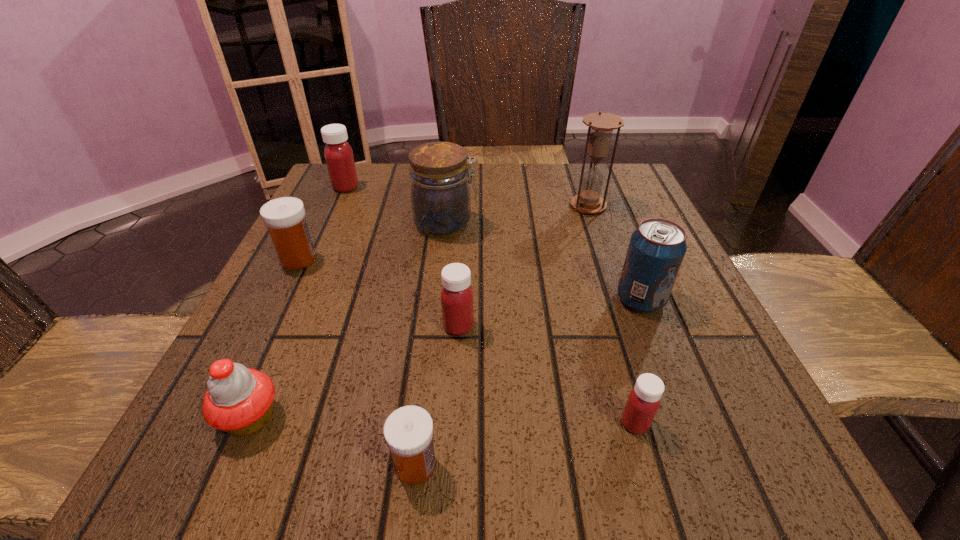
Where is `medicine that stands as the third closest to the hourglass`? The width and height of the screenshot is (960, 540). medicine that stands as the third closest to the hourglass is located at coordinates (338, 154).

Identify the location of medicine that is the second closest to the third farthest medicine. (643, 402).

Identify which red medicine is located as the nearest to the biggest red medicine. Please provide its 2D coordinates. Your answer should be formatted as a tuple, i.e. [(x, y)], where the tuple contains the x and y coordinates of a point satisfying the conditions above.

[(457, 306)]

At what (x,y) coordinates should I click in order to perform the action: click on red medicine that stands as the second closest to the pop soda. Please return your answer as a coordinate pair (x, y). Looking at the image, I should click on (457, 306).

Locate an element on the screen. The height and width of the screenshot is (540, 960). vacant space that satisfies the following two spatial constraints: 1. on the back side of the pop soda; 2. on the lid of the jar is located at coordinates (611, 225).

This screenshot has height=540, width=960. I want to click on free space that satisfies the following two spatial constraints: 1. on the front side of the leftmost red medicine; 2. on the left side of the red cupcake, so [241, 417].

Find the location of `vacant space that satisfies the following two spatial constraints: 1. on the lid of the jar; 2. on the right side of the nearest red medicine`. vacant space that satisfies the following two spatial constraints: 1. on the lid of the jar; 2. on the right side of the nearest red medicine is located at coordinates (425, 423).